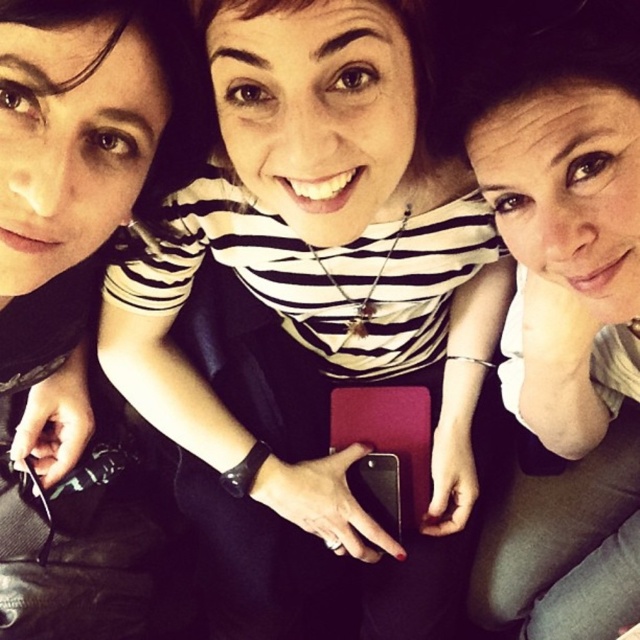
Question: Can you confirm if matte black phone at center is positioned to the right of matte black shirt at upper left?

Choices:
 (A) yes
 (B) no

Answer: (A)

Question: Does matte black phone at center have a larger size compared to matte black shirt at center?

Choices:
 (A) no
 (B) yes

Answer: (B)

Question: Which object is farther from the camera taking this photo?

Choices:
 (A) matte black shirt at center
 (B) matte black shirt at upper left
 (C) matte black phone at center

Answer: (A)

Question: Is matte black phone at center above matte black shirt at upper left?

Choices:
 (A) yes
 (B) no

Answer: (B)

Question: Which of these objects is positioned closest to the matte black shirt at center?

Choices:
 (A) matte black phone at center
 (B) matte black shirt at upper left

Answer: (A)

Question: Estimate the real-world distances between objects in this image. Which object is closer to the matte black shirt at center?

Choices:
 (A) matte black phone at center
 (B) matte black shirt at upper left

Answer: (A)